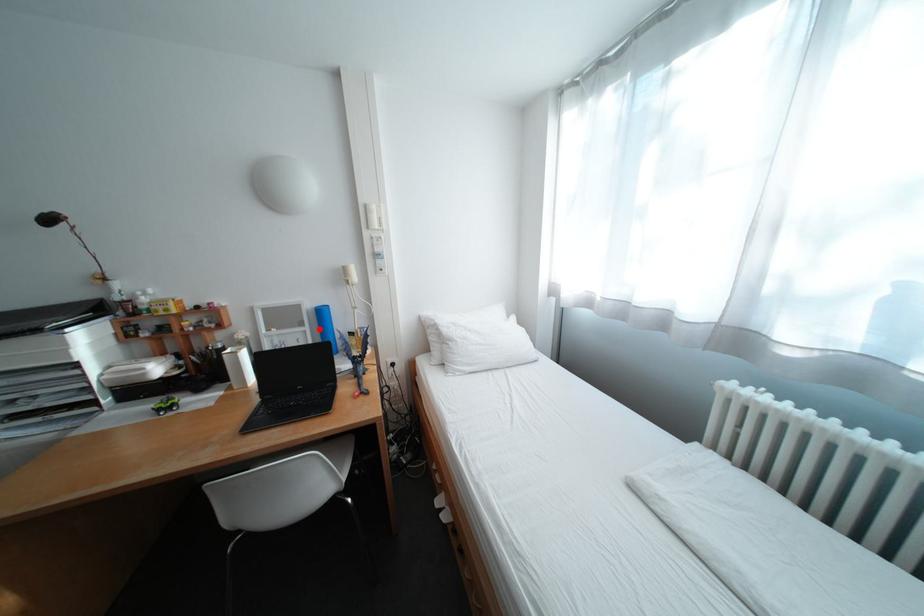
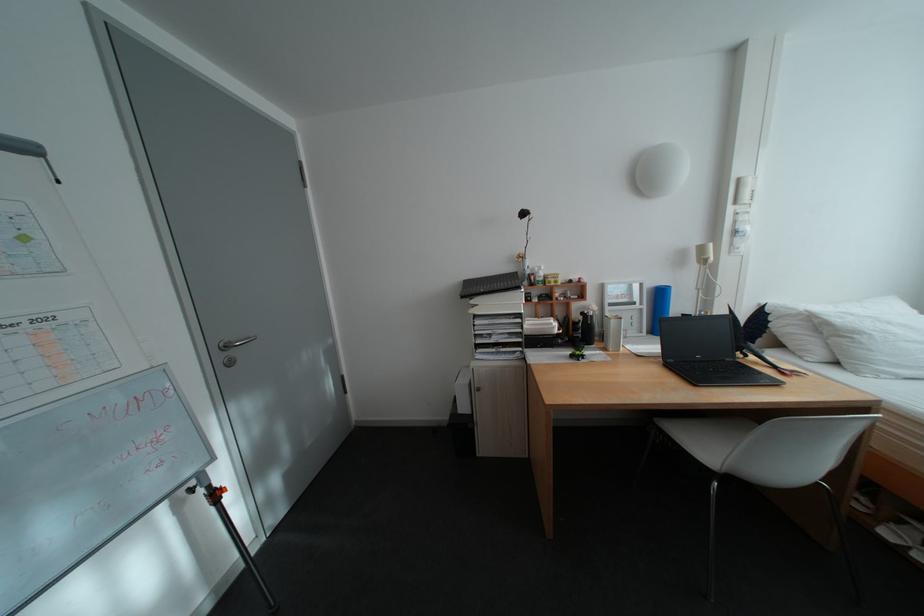
In the second image, find the point that corresponds to the highlighted location in the first image.

(657, 307)